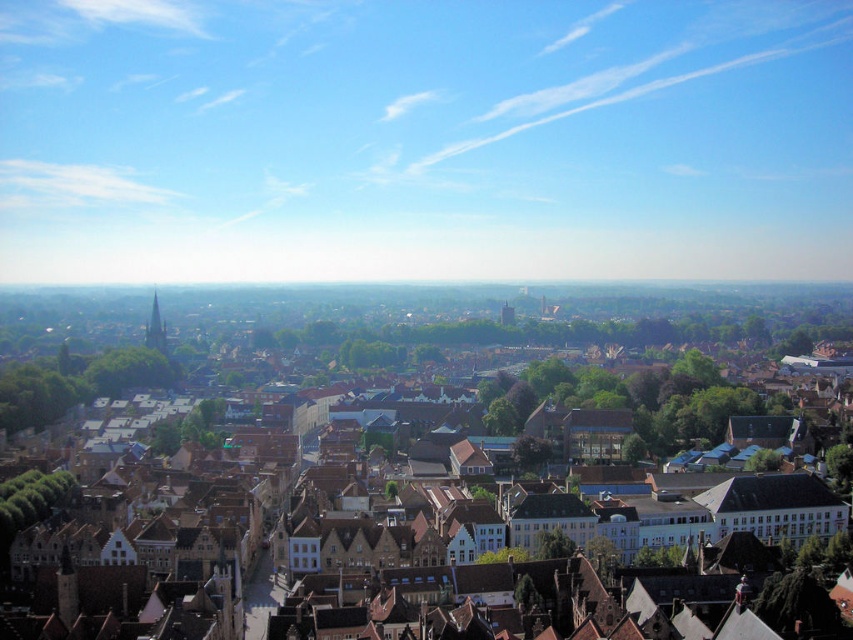
You are an architect evaluating the urban layout of this historic city. You notice the brown brick buildings at center and the green stone tower at left. Which structure would require a taller crane for construction? Please base your answer on their relative heights as depicted in the image.

The brown brick buildings at center is taller than the green stone tower at left, so a taller crane would be needed for the brown brick buildings at center.

You are standing in a historic European city and want to take a photo of the brown brick buildings at center. If your camera has a maximum zoom range of 100 feet, can you capture the entire structure without moving closer?

The brown brick buildings at center is 432.25 feet from viewer. Since the camera can only zoom up to 100 feet, you cannot capture the entire structure without moving closer.